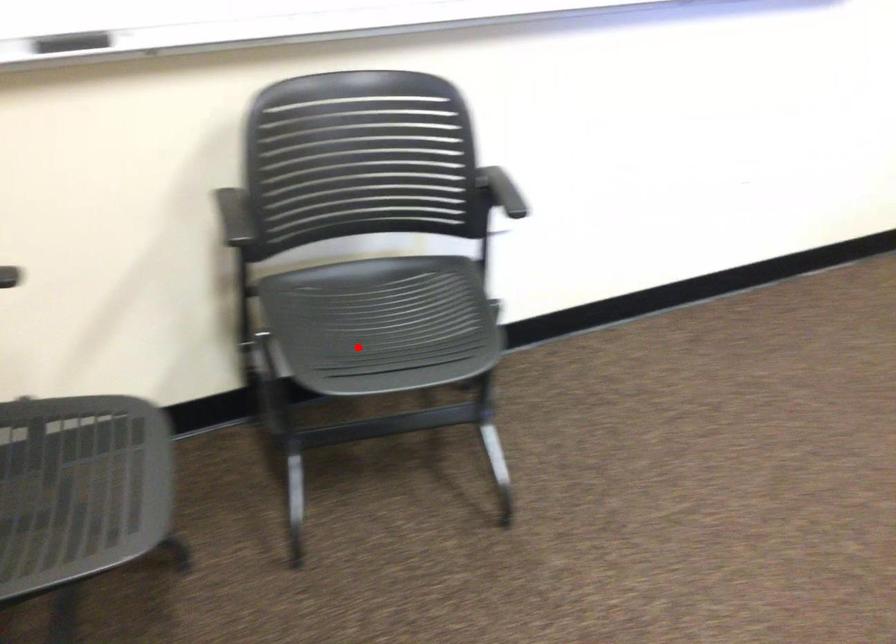
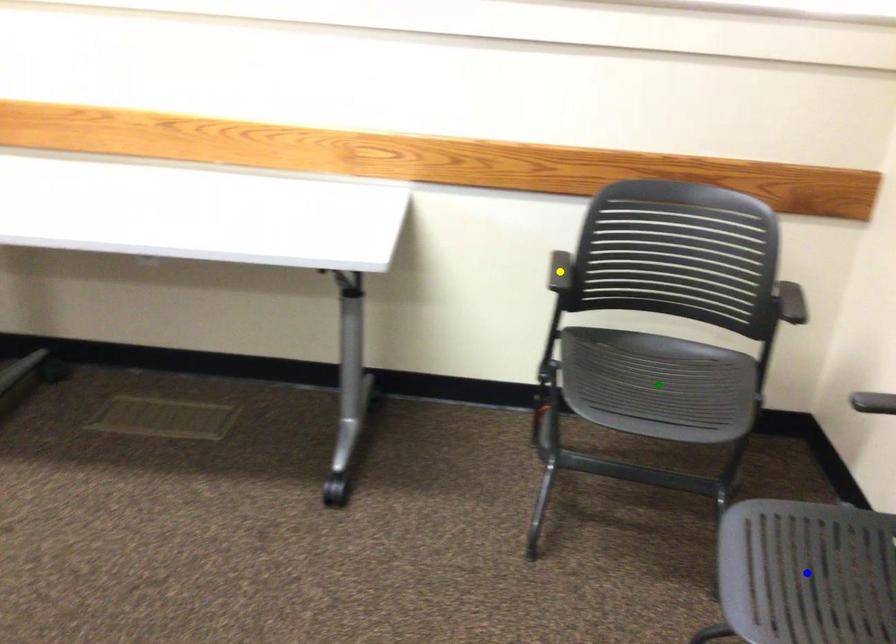
Question: I am providing you with two images of the same scene from different viewpoints. A red point is marked on the first image. You are given multiple points on the second image. Which mark in image 2 goes with the point in image 1?

Choices:
 (A) blue point
 (B) green point
 (C) yellow point

Answer: (A)